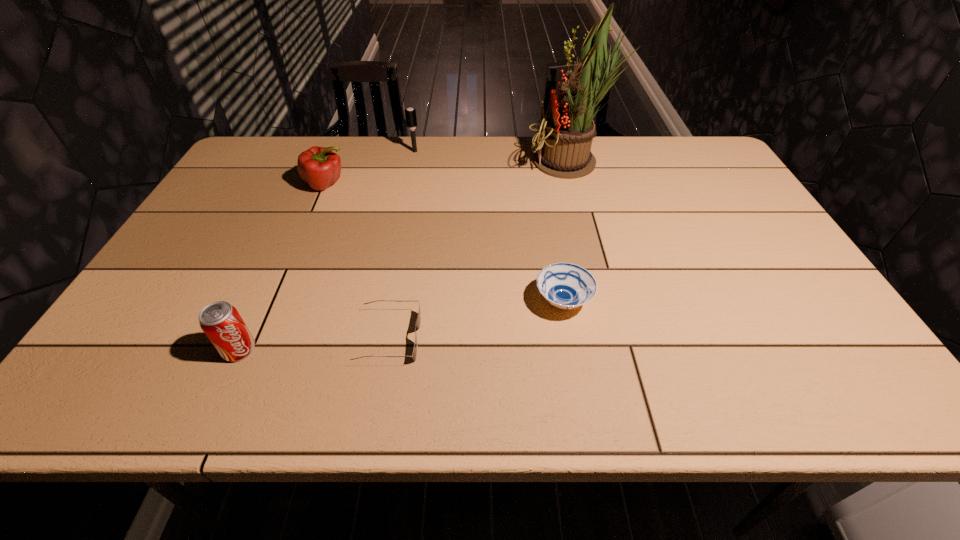
Where is `flower arrangement`? This screenshot has width=960, height=540. flower arrangement is located at coordinates (564, 140).

Locate an element on the screen. The image size is (960, 540). the fifth shortest object is located at coordinates (410, 113).

Where is `bell pepper`? The height and width of the screenshot is (540, 960). bell pepper is located at coordinates (318, 166).

This screenshot has height=540, width=960. Identify the location of soda can. (220, 321).

This screenshot has width=960, height=540. Find the location of `soup bowl`. soup bowl is located at coordinates (564, 285).

Identify the location of sunglasses. (414, 354).

In order to click on blank space located 0.060m in front of the tallest object with the fan visible in this screenshot , I will do `click(510, 163)`.

Locate an element on the screen. This screenshot has height=540, width=960. vacant space located 0.060m in front of the tallest object with the fan visible is located at coordinates (510, 163).

This screenshot has width=960, height=540. I want to click on free location located 0.220m in front of the tallest object with the fan visible, so click(x=460, y=163).

This screenshot has height=540, width=960. Find the location of `vacant region located on the left of the fifth shortest object`. vacant region located on the left of the fifth shortest object is located at coordinates (302, 151).